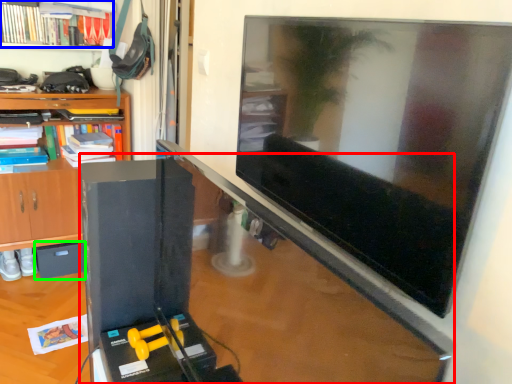
Question: Considering the real-world distances, which object is farthest from computer desk (highlighted by a red box)? book (highlighted by a blue box) or drawer (highlighted by a green box)?

Choices:
 (A) book
 (B) drawer

Answer: (A)